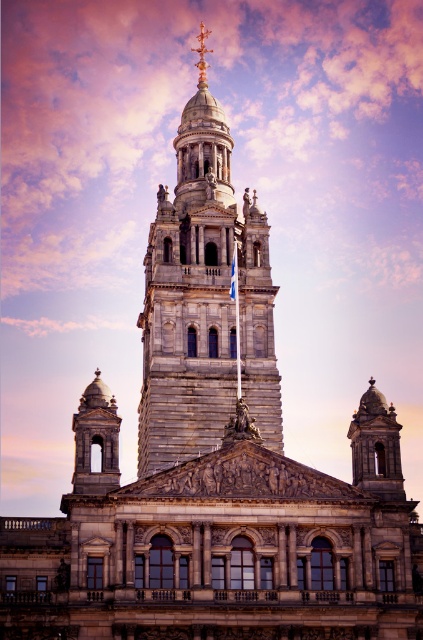
Who is positioned more to the left, stone tower at center or smooth stone bell tower at left?

smooth stone bell tower at left is more to the left.

Who is taller, stone tower at center or smooth stone bell tower at left?

Standing taller between the two is stone tower at center.

The image size is (423, 640). In order to click on stone tower at center in this screenshot , I will do `click(203, 300)`.

Does stone tower at center have a lesser height compared to smooth stone dome at upper center?

No, stone tower at center is not shorter than smooth stone dome at upper center.

Does stone tower at center have a larger size compared to smooth stone dome at upper center?

Yes, stone tower at center is bigger than smooth stone dome at upper center.

You are a GUI agent. You are given a task and a screenshot of the screen. Output one action in this format:
    pyautogui.click(x=<x>, y=<y>)
    Task: Click on the stone tower at center
    
    Given the screenshot: What is the action you would take?
    point(203,300)

Is smooth stone dome at upper center wider than smooth stone bell tower at left?

In fact, smooth stone dome at upper center might be narrower than smooth stone bell tower at left.

Does smooth stone dome at upper center have a smaller size compared to smooth stone bell tower at left?

Correct, smooth stone dome at upper center occupies less space than smooth stone bell tower at left.

Who is more forward, (387, 481) or (115, 484)?

Point (115, 484) is more forward.

Where is `smooth stone dome at upper center`? The width and height of the screenshot is (423, 640). smooth stone dome at upper center is located at coordinates (376, 445).